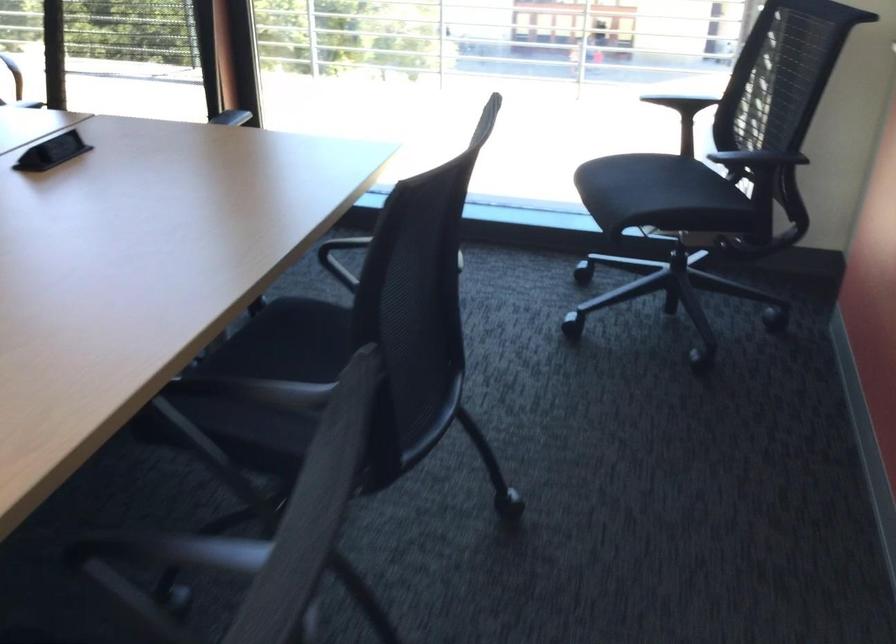
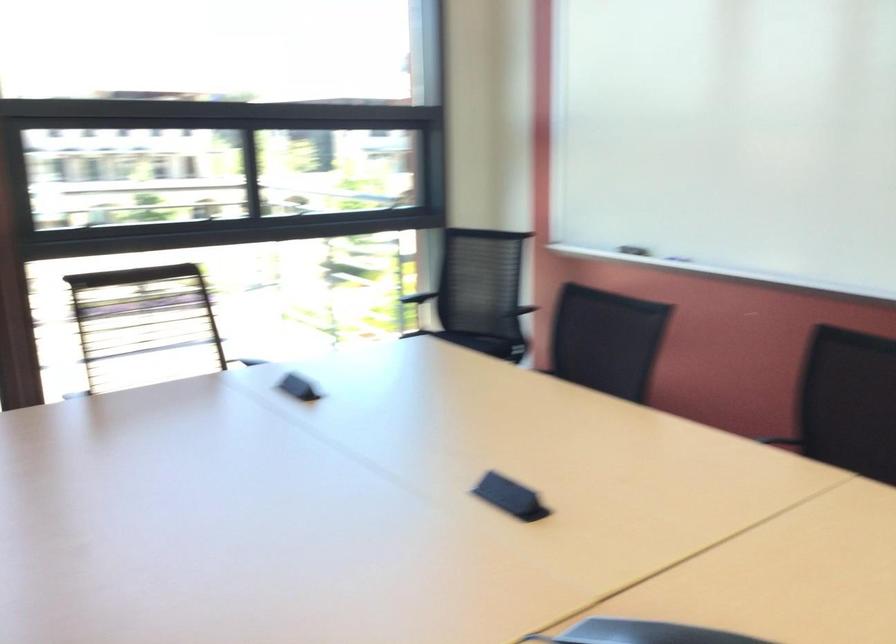
In the second image, find the point that corresponds to (x=730, y=140) in the first image.

(504, 308)